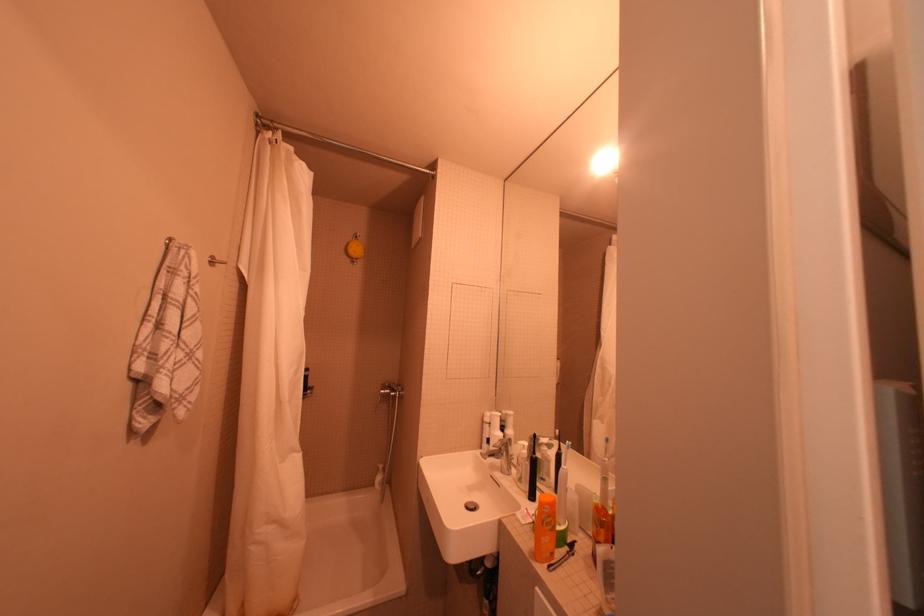
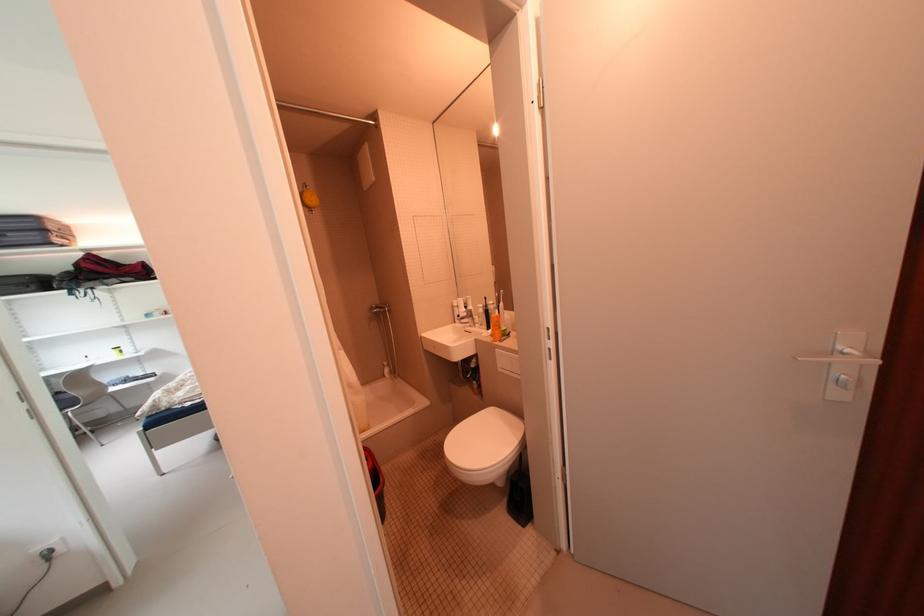
Where in the second image is the point corresponding to [556,517] from the first image?

(505, 323)